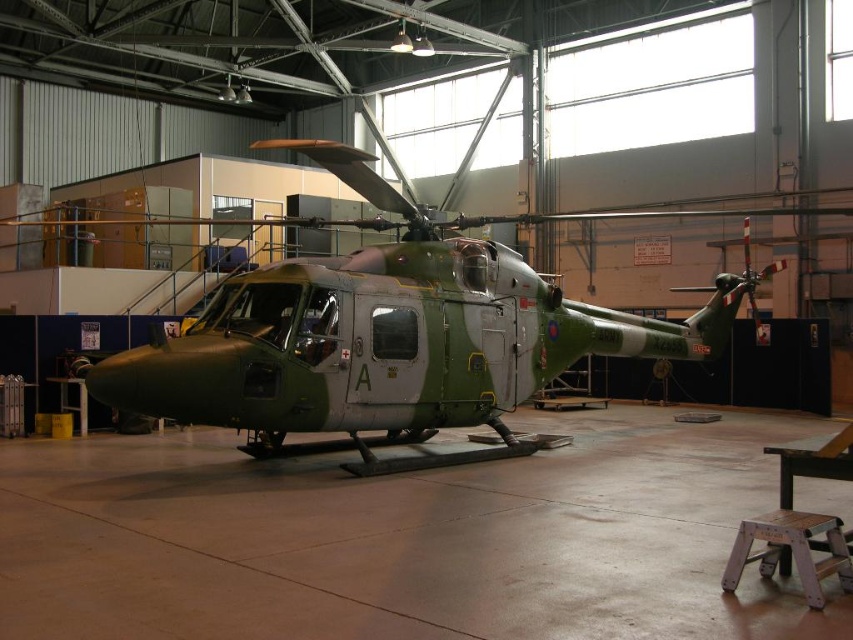
Question: Which of the following is the closest to the observer?

Choices:
 (A) (727, 580)
 (B) (326, 364)

Answer: (A)

Question: Does camouflage paint helicopter at center appear under wooden stool at lower right?

Choices:
 (A) no
 (B) yes

Answer: (A)

Question: Does camouflage paint helicopter at center have a larger size compared to wooden stool at lower right?

Choices:
 (A) no
 (B) yes

Answer: (B)

Question: Does camouflage paint helicopter at center have a lesser width compared to wooden stool at lower right?

Choices:
 (A) no
 (B) yes

Answer: (A)

Question: Which of the following is the closest to the observer?

Choices:
 (A) (805, 545)
 (B) (421, 376)

Answer: (A)